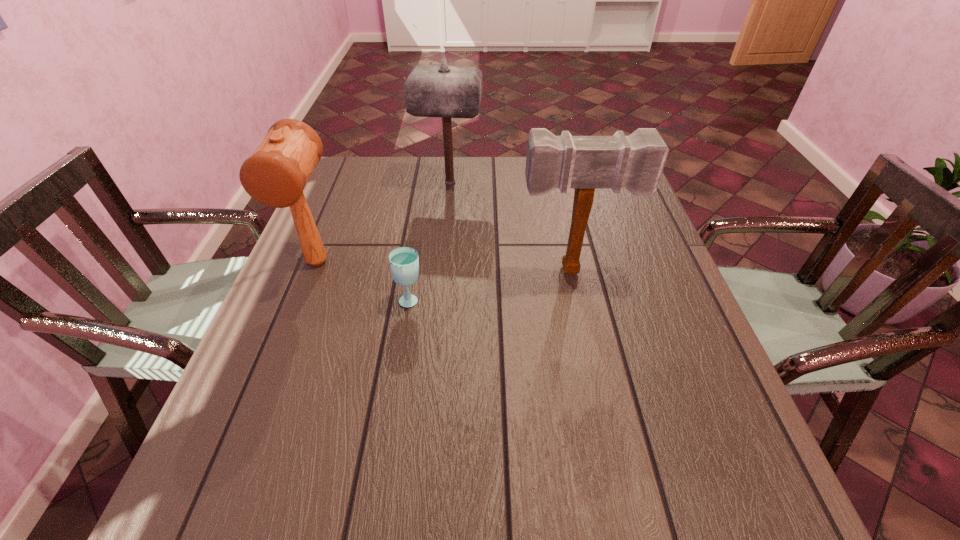
What are the coordinates of `the farthest object` in the screenshot? It's located at (444, 91).

The width and height of the screenshot is (960, 540). What are the coordinates of `the second mallet from left to right` in the screenshot? It's located at (444, 91).

The image size is (960, 540). What are the coordinates of `the rightmost mallet` in the screenshot? It's located at pos(635,162).

You are a GUI agent. You are given a task and a screenshot of the screen. Output one action in this format:
    pyautogui.click(x=<x>, y=<y>)
    Task: Click on the leftmost object
    The image size is (960, 540).
    Given the screenshot: What is the action you would take?
    pyautogui.click(x=275, y=175)

Where is `the shortest object`? the shortest object is located at coordinates (404, 261).

This screenshot has width=960, height=540. Find the location of `glass`. glass is located at coordinates (404, 261).

Find the location of a particular element. vacant space located 0.340m on the right of the second mallet from right to left is located at coordinates (593, 182).

At what (x,y) coordinates should I click in order to perform the action: click on free space located on the front of the rightmost mallet. Please return your answer as a coordinate pair (x, y). The width and height of the screenshot is (960, 540). Looking at the image, I should click on (592, 361).

The height and width of the screenshot is (540, 960). What are the coordinates of `free region located on the strike surface of the leftmost mallet` in the screenshot? It's located at click(x=239, y=460).

You are a GUI agent. You are given a task and a screenshot of the screen. Output one action in this format:
    pyautogui.click(x=<x>, y=<y>)
    Task: Click on the vacant space located on the back of the glass
    This screenshot has height=540, width=960.
    Given the screenshot: What is the action you would take?
    pyautogui.click(x=424, y=211)